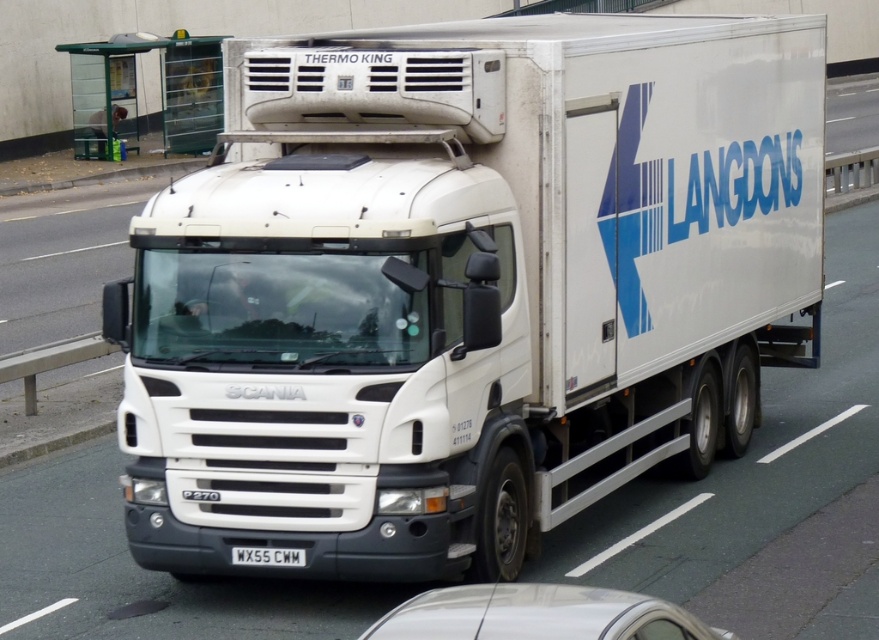
You are a traffic officer observing a white matte truck at center and a white plastic license plate at center. Which object is positioned more to the left?

The white plastic license plate at center is positioned more to the left than the white matte truck at center.

You are a traffic officer observing a road scene. You need to report the position of the white matte truck at center in the image. What are its coordinates?

The white matte truck at center is located at coordinates point (465, 285).